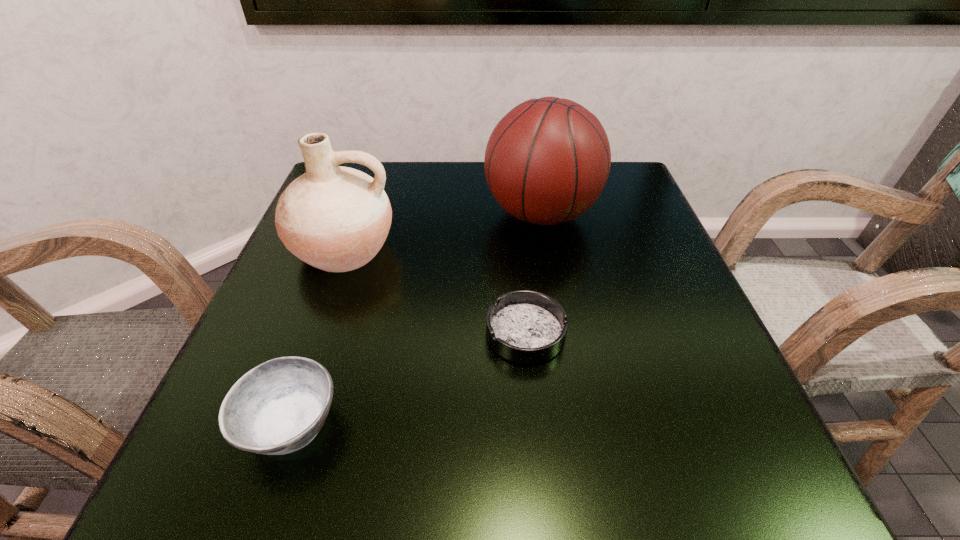
Identify the location of object that is at the far edge. (547, 160).

I want to click on object that is at the near edge, so click(278, 407).

The height and width of the screenshot is (540, 960). What are the coordinates of `pottery that is at the left edge` in the screenshot? It's located at (334, 218).

Identify the location of ashtray positioned at the left edge. The width and height of the screenshot is (960, 540). (278, 407).

Find the location of `object that is at the right edge`. object that is at the right edge is located at coordinates (547, 160).

Locate an element on the screen. This screenshot has width=960, height=540. object that is at the near left corner is located at coordinates (278, 407).

The image size is (960, 540). In order to click on object situated at the far right corner in this screenshot , I will do `click(547, 160)`.

At what (x,y) coordinates should I click in order to perform the action: click on free space at the far edge of the desktop. Please return your answer as a coordinate pair (x, y). This screenshot has height=540, width=960. Looking at the image, I should click on (439, 212).

Image resolution: width=960 pixels, height=540 pixels. In the image, there is a desktop. In order to click on vacant space at the left edge in this screenshot , I will do `click(292, 325)`.

Identify the location of vacant space at the right edge. The height and width of the screenshot is (540, 960). (612, 217).